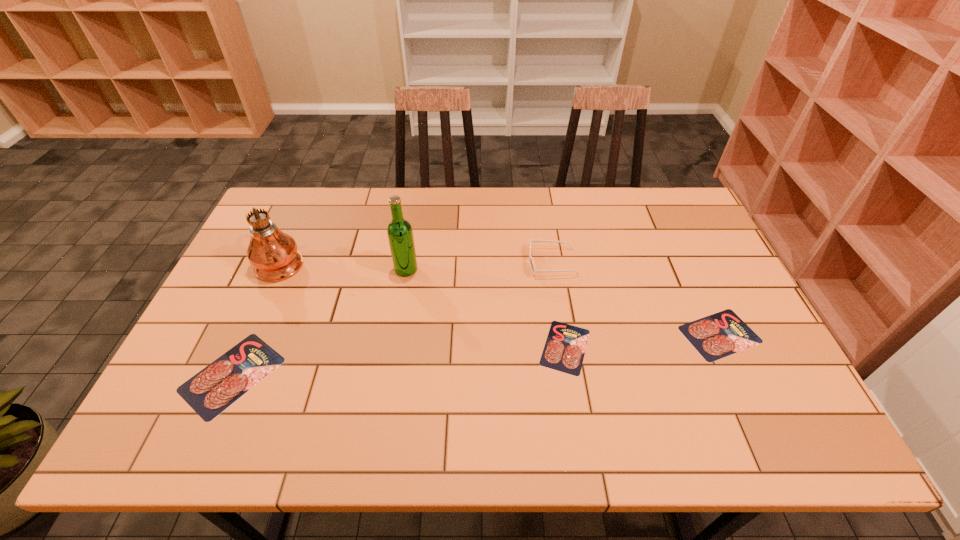
The image size is (960, 540). Identify the location of vacant space that satisfies the following two spatial constraints: 1. on the back side of the rightmost object; 2. with the lenses of the third tallest object facing outward. (686, 262).

This screenshot has height=540, width=960. Identify the location of vacant region that satisfies the following two spatial constraints: 1. on the back side of the second shortest object; 2. on the left side of the second salami from right to left. (564, 334).

Where is `free spot that satisfies the following two spatial constraints: 1. on the front side of the tallest object; 2. on the left side of the second shortest object`? free spot that satisfies the following two spatial constraints: 1. on the front side of the tallest object; 2. on the left side of the second shortest object is located at coordinates (248, 334).